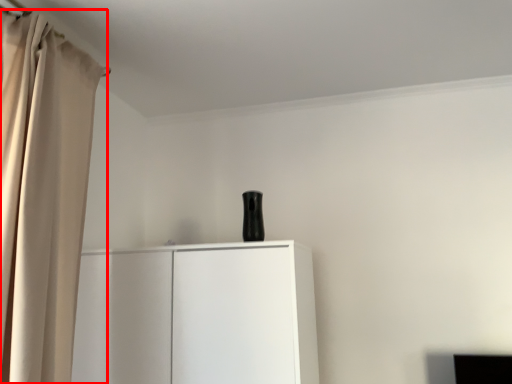
Question: From the image's perspective, where is curtain (annotated by the red box) located in relation to cupboard in the image?

Choices:
 (A) above
 (B) below

Answer: (A)